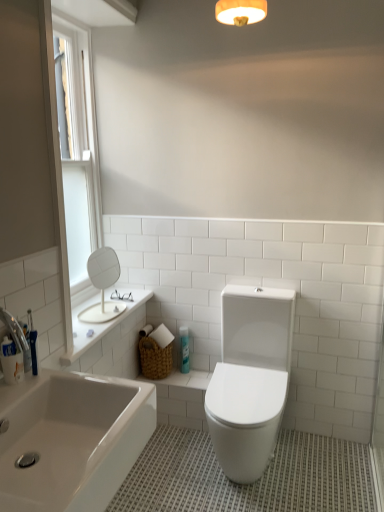
Locate an element on the screen. This screenshot has height=512, width=384. blue glossy spray can at center is located at coordinates (184, 349).

The height and width of the screenshot is (512, 384). I want to click on white plastic window screen at upper left, so click(78, 85).

Image resolution: width=384 pixels, height=512 pixels. In order to click on white matte round mirror at upper left in this screenshot , I will do `click(103, 285)`.

Measure the distance between point [234,411] and camera.

Point [234,411] and camera are 6.00 feet apart from each other.

This screenshot has height=512, width=384. In order to click on blue glossy spray can at center in this screenshot , I will do `click(184, 349)`.

Is white plastic window screen at upper left further to camera compared to white matte round mirror at upper left?

That is False.

Considering the relative sizes of white plastic window screen at upper left and white matte round mirror at upper left in the image provided, is white plastic window screen at upper left thinner than white matte round mirror at upper left?

Yes.

Based on the photo, would you say white matte round mirror at upper left is part of white plastic window screen at upper left's contents?

No.

Between white plastic window screen at upper left and white matte round mirror at upper left, which one appears on the left side from the viewer's perspective?

white plastic window screen at upper left is more to the left.

Is the depth of white glossy bathtub at lower left greater than that of white glossy toilet at center?

No.

Is white glossy bathtub at lower left turned away from white glossy toilet at center?

No, white glossy bathtub at lower left's orientation is not away from white glossy toilet at center.

In terms of size, does white glossy bathtub at lower left appear bigger or smaller than white glossy toilet at center?

In the image, white glossy bathtub at lower left appears to be smaller than white glossy toilet at center.

Considering the positions of objects white matte round mirror at upper left and white glossy toilet at center in the image provided, who is in front, white matte round mirror at upper left or white glossy toilet at center?

white glossy toilet at center.

Is white matte round mirror at upper left wider or thinner than white glossy toilet at center?

In the image, white matte round mirror at upper left appears to be more narrow than white glossy toilet at center.

From a real-world perspective, is white matte round mirror at upper left positioned above or below white glossy toilet at center?

In terms of real-world spatial position, white matte round mirror at upper left is above white glossy toilet at center.

Based on the photo, from the image's perspective, between white matte round mirror at upper left and white glossy toilet at center, which one is located above?

From the image's view, white matte round mirror at upper left is above.

From the image's perspective, would you say blue glossy spray can at center is shown under white glossy bathtub at lower left?

No, from the image's perspective, blue glossy spray can at center is not below white glossy bathtub at lower left.

Does blue glossy spray can at center have a smaller size compared to white glossy bathtub at lower left?

Indeed, blue glossy spray can at center has a smaller size compared to white glossy bathtub at lower left.

Is the surface of blue glossy spray can at center in direct contact with white glossy bathtub at lower left?

blue glossy spray can at center and white glossy bathtub at lower left are clearly separated.

Is white glossy bathtub at lower left shorter than white matte round mirror at upper left?

No, white glossy bathtub at lower left is not shorter than white matte round mirror at upper left.

Does point (104, 479) appear closer or farther from the camera than point (98, 275)?

Point (104, 479) is positioned closer to the camera compared to point (98, 275).

Does white glossy bathtub at lower left contain white matte round mirror at upper left?

That's incorrect, white matte round mirror at upper left is not inside white glossy bathtub at lower left.

Is white matte round mirror at upper left oriented towards white glossy bathtub at lower left?

No.

Does point (84, 316) come behind point (3, 433)?

Yes, point (84, 316) is farther from viewer.

How much distance is there between white matte round mirror at upper left and white glossy bathtub at lower left?

The distance of white matte round mirror at upper left from white glossy bathtub at lower left is 33.83 inches.

Is white matte round mirror at upper left not within white glossy bathtub at lower left?

Absolutely, white matte round mirror at upper left is external to white glossy bathtub at lower left.

Is white glossy toilet at center bigger or smaller than white glossy bathtub at lower left?

Considering their sizes, white glossy toilet at center takes up more space than white glossy bathtub at lower left.

Between white glossy toilet at center and white glossy bathtub at lower left, which one has smaller width?

white glossy bathtub at lower left.

From a real-world perspective, is white glossy toilet at center located higher than white glossy bathtub at lower left?

No, from a real-world perspective, white glossy toilet at center is not on top of white glossy bathtub at lower left.

Measure the distance between white glossy toilet at center and white glossy bathtub at lower left.

The distance of white glossy toilet at center from white glossy bathtub at lower left is 30.16 inches.

Find the location of a particular element. The width and height of the screenshot is (384, 512). window screen on the left side of white matte round mirror at upper left is located at coordinates (78, 85).

Locate an element on the screen. This screenshot has width=384, height=512. toilet lying above the white glossy bathtub at lower left (from the image's perspective) is located at coordinates (250, 378).

Estimate the real-world distances between objects in this image. Which object is further from white glossy bathtub at lower left, white plastic window screen at upper left or blue glossy spray can at center?

white plastic window screen at upper left is further to white glossy bathtub at lower left.

Considering their positions, is white matte round mirror at upper left positioned closer to white glossy toilet at center than white plastic window screen at upper left?

white matte round mirror at upper left is closer to white glossy toilet at center.

Which object lies nearer to the anchor point white glossy toilet at center, white matte round mirror at upper left or blue glossy spray can at center?

blue glossy spray can at center is closer to white glossy toilet at center.

Based on the photo, when comparing their distances from white matte round mirror at upper left, does white glossy bathtub at lower left or white plastic window screen at upper left seem closer?

white plastic window screen at upper left.

Which object lies further to the anchor point white glossy toilet at center, white glossy bathtub at lower left or white plastic window screen at upper left?

Based on the image, white plastic window screen at upper left appears to be further to white glossy toilet at center.

When comparing their distances from white plastic window screen at upper left, does white glossy toilet at center or blue glossy spray can at center seem further?

Based on the image, white glossy toilet at center appears to be further to white plastic window screen at upper left.

Based on their spatial positions, is white glossy bathtub at lower left or white glossy toilet at center closer to white matte round mirror at upper left?

Based on the image, white glossy toilet at center appears to be nearer to white matte round mirror at upper left.

In the scene shown: Which object lies further to the anchor point white plastic window screen at upper left, white glossy toilet at center or white glossy bathtub at lower left?

Based on the image, white glossy bathtub at lower left appears to be further to white plastic window screen at upper left.

Identify the location of toilet between white glossy bathtub at lower left and white matte round mirror at upper left in the front-back direction. The height and width of the screenshot is (512, 384). (250, 378).

You are a GUI agent. You are given a task and a screenshot of the screen. Output one action in this format:
    pyautogui.click(x=<x>, y=<y>)
    Task: Click on the mirror between white plastic window screen at upper left and blue glossy spray can at center in the up-down direction
    
    Given the screenshot: What is the action you would take?
    pyautogui.click(x=103, y=285)

This screenshot has width=384, height=512. I want to click on window screen located between white glossy bathtub at lower left and blue glossy spray can at center in the depth direction, so click(x=78, y=85).

I want to click on mirror between white glossy toilet at center and blue glossy spray can at center in the front-back direction, so click(103, 285).